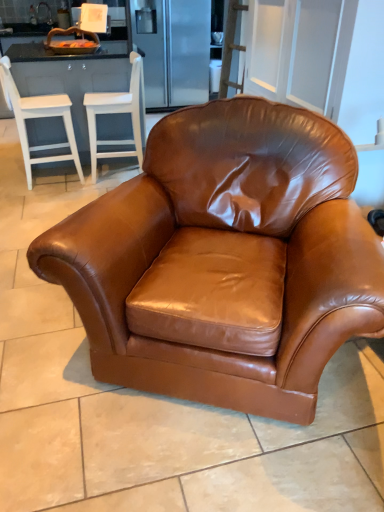
Describe the element at coordinates (68, 79) in the screenshot. I see `white wood barstools at left` at that location.

What is the approximate height of white wood bar stool at left, positioned as the 3th chair in right-to-left order?

The height of white wood bar stool at left, positioned as the 3th chair in right-to-left order, is 36.85 inches.

At what (x,y) coordinates should I click in order to perform the action: click on saddle brown leather armchair at center, the first chair in the front-to-back sequence. Please return your answer as a coordinate pair (x, y). Looking at the image, I should click on (225, 247).

This screenshot has height=512, width=384. Identify the location of white wood barstools at left. tap(68, 79).

Looking at the image, does brown leather armchair at center, positioned as the second chair in right-to-left order, seem bigger or smaller compared to white wood barstools at left?

Considering their sizes, brown leather armchair at center, positioned as the second chair in right-to-left order, takes up less space than white wood barstools at left.

At what (x,y) coordinates should I click in order to perform the action: click on dresser behind the brown leather armchair at center, which ranks as the first chair in back-to-front order. Please return your answer as a coordinate pair (x, y). Looking at the image, I should click on (68, 79).

Is brown leather armchair at center, which ranks as the first chair in back-to-front order, looking in the opposite direction of white wood barstools at left?

No, white wood barstools at left is not at the back of brown leather armchair at center, which ranks as the first chair in back-to-front order.

Between brown leather armchair at center, positioned as the second chair in right-to-left order, and white wood barstools at left, which one appears on the right side from the viewer's perspective?

Positioned to the right is brown leather armchair at center, positioned as the second chair in right-to-left order.

Considering the relative sizes of white wood bar stool at left, positioned as the 3th chair in right-to-left order, and saddle brown leather armchair at center, which ranks as the 1th chair in right-to-left order, in the image provided, is white wood bar stool at left, positioned as the 3th chair in right-to-left order, bigger than saddle brown leather armchair at center, which ranks as the 1th chair in right-to-left order,?

No, white wood bar stool at left, positioned as the 3th chair in right-to-left order, is not bigger than saddle brown leather armchair at center, which ranks as the 1th chair in right-to-left order.

From a real-world perspective, is white wood bar stool at left, arranged as the second chair when viewed from the front, physically above saddle brown leather armchair at center, acting as the third chair starting from the back?

Incorrect, from a real-world perspective, white wood bar stool at left, arranged as the second chair when viewed from the front, is lower than saddle brown leather armchair at center, acting as the third chair starting from the back.

Relative to saddle brown leather armchair at center, acting as the third chair starting from the back, is white wood bar stool at left, placed as the second chair when sorted from back to front, in front or behind?

white wood bar stool at left, placed as the second chair when sorted from back to front, is behind saddle brown leather armchair at center, acting as the third chair starting from the back.

Considering the relative sizes of saddle brown leather armchair at center, acting as the third chair starting from the back, and brown leather armchair at center, the third chair in the front-to-back sequence, in the image provided, is saddle brown leather armchair at center, acting as the third chair starting from the back, bigger than brown leather armchair at center, the third chair in the front-to-back sequence,?

Yes, saddle brown leather armchair at center, acting as the third chair starting from the back, is bigger than brown leather armchair at center, the third chair in the front-to-back sequence.

How different are the orientations of saddle brown leather armchair at center, which ranks as the 1th chair in right-to-left order, and brown leather armchair at center, the third chair in the front-to-back sequence, in degrees?

58.7 degrees.

Who is more distant, saddle brown leather armchair at center, which ranks as the 1th chair in right-to-left order, or brown leather armchair at center, positioned as the second chair in right-to-left order?

brown leather armchair at center, positioned as the second chair in right-to-left order, is more distant.

Is saddle brown leather armchair at center, which is counted as the third chair, starting from the left, completely or partially outside of brown leather armchair at center, which ranks as the first chair in back-to-front order?

saddle brown leather armchair at center, which is counted as the third chair, starting from the left, is positioned outside brown leather armchair at center, which ranks as the first chair in back-to-front order.

Does saddle brown leather armchair at center, the first chair in the front-to-back sequence, have a greater height compared to white wood barstools at left?

Yes, saddle brown leather armchair at center, the first chair in the front-to-back sequence, is taller than white wood barstools at left.

Could you tell me if saddle brown leather armchair at center, the first chair in the front-to-back sequence, is facing white wood barstools at left?

No, saddle brown leather armchair at center, the first chair in the front-to-back sequence, does not turn towards white wood barstools at left.

Does saddle brown leather armchair at center, which ranks as the 1th chair in right-to-left order, appear on the right side of white wood barstools at left?

Yes, saddle brown leather armchair at center, which ranks as the 1th chair in right-to-left order, is to the right of white wood barstools at left.

From a real-world perspective, which object stands above the other?

From a 3D spatial view, saddle brown leather armchair at center, acting as the third chair starting from the back, is above.

This screenshot has width=384, height=512. Identify the location of dresser located on the right of white wood bar stool at left, the first chair positioned from the left. (68, 79).

Which object is closer to the camera, white wood bar stool at left, the first chair positioned from the left, or white wood barstools at left?

white wood bar stool at left, the first chair positioned from the left, is more forward.

From the image's perspective, which one is positioned lower, white wood bar stool at left, positioned as the 3th chair in right-to-left order, or white wood barstools at left?

white wood bar stool at left, positioned as the 3th chair in right-to-left order, appears lower in the image.

From a real-world perspective, which is physically below, white wood bar stool at left, positioned as the 3th chair in right-to-left order, or white wood barstools at left?

white wood barstools at left is physically lower.

From a real-world perspective, is brown leather armchair at center, which ranks as the first chair in back-to-front order, under white wood bar stool at left, arranged as the second chair when viewed from the front?

Yes.

Which object is further away from the camera taking this photo, brown leather armchair at center, which ranks as the first chair in back-to-front order, or white wood bar stool at left, placed as the second chair when sorted from back to front?

Positioned behind is brown leather armchair at center, which ranks as the first chair in back-to-front order.

Which of these two, brown leather armchair at center, the second chair viewed from the left, or white wood bar stool at left, placed as the second chair when sorted from back to front, is smaller?

white wood bar stool at left, placed as the second chair when sorted from back to front.

Considering the points (139, 156) and (7, 82), which point is behind, point (139, 156) or point (7, 82)?

The point (139, 156) is farther from the camera.

Would you say saddle brown leather armchair at center, which ranks as the 1th chair in right-to-left order, is part of white wood barstools at left's contents?

That's incorrect, saddle brown leather armchair at center, which ranks as the 1th chair in right-to-left order, is not inside white wood barstools at left.

Considering the sizes of white wood barstools at left and saddle brown leather armchair at center, which ranks as the 1th chair in right-to-left order, in the image, is white wood barstools at left wider or thinner than saddle brown leather armchair at center, which ranks as the 1th chair in right-to-left order,?

white wood barstools at left is thinner than saddle brown leather armchair at center, which ranks as the 1th chair in right-to-left order.

Are white wood barstools at left and saddle brown leather armchair at center, which ranks as the 1th chair in right-to-left order, beside each other?

No.

Identify the location of the 1st chair in front of the white wood barstools at left, starting your count from the anchor. The image size is (384, 512). (117, 113).

The image size is (384, 512). Find the location of `chair above the white wood bar stool at left, placed as the second chair when sorted from back to front (from a real-world perspective)`. chair above the white wood bar stool at left, placed as the second chair when sorted from back to front (from a real-world perspective) is located at coordinates (225, 247).

When comparing their distances from white wood barstools at left, does white wood bar stool at left, arranged as the second chair when viewed from the front, or brown leather armchair at center, which ranks as the first chair in back-to-front order, seem closer?

The object closer to white wood barstools at left is brown leather armchair at center, which ranks as the first chair in back-to-front order.

Estimate the real-world distances between objects in this image. Which object is further from saddle brown leather armchair at center, which ranks as the 1th chair in right-to-left order, brown leather armchair at center, which ranks as the first chair in back-to-front order, or white wood barstools at left?

white wood barstools at left.

When comparing their distances from white wood bar stool at left, the first chair positioned from the left, does saddle brown leather armchair at center, the first chair in the front-to-back sequence, or white wood barstools at left seem further?

saddle brown leather armchair at center, the first chair in the front-to-back sequence.

In the scene shown: Considering their positions, is saddle brown leather armchair at center, acting as the third chair starting from the back, positioned further to white wood barstools at left than brown leather armchair at center, positioned as the second chair in right-to-left order?

saddle brown leather armchair at center, acting as the third chair starting from the back, is positioned further to the anchor white wood barstools at left.

Estimate the real-world distances between objects in this image. Which object is further from saddle brown leather armchair at center, which ranks as the 1th chair in right-to-left order, white wood bar stool at left, arranged as the second chair when viewed from the front, or white wood barstools at left?

white wood bar stool at left, arranged as the second chair when viewed from the front, lies further to saddle brown leather armchair at center, which ranks as the 1th chair in right-to-left order, than the other object.

From the image, which object appears to be nearer to saddle brown leather armchair at center, which ranks as the 1th chair in right-to-left order, brown leather armchair at center, the third chair in the front-to-back sequence, or white wood bar stool at left, arranged as the second chair when viewed from the front?

Based on the image, brown leather armchair at center, the third chair in the front-to-back sequence, appears to be nearer to saddle brown leather armchair at center, which ranks as the 1th chair in right-to-left order.

Based on their spatial positions, is white wood barstools at left or saddle brown leather armchair at center, which is counted as the third chair, starting from the left, further from brown leather armchair at center, the second chair viewed from the left?

saddle brown leather armchair at center, which is counted as the third chair, starting from the left.

From the image, which object appears to be farther from white wood barstools at left, white wood bar stool at left, placed as the second chair when sorted from back to front, or saddle brown leather armchair at center, which is counted as the third chair, starting from the left?

Among the two, saddle brown leather armchair at center, which is counted as the third chair, starting from the left, is located further to white wood barstools at left.

Locate an element on the screen. dresser between white wood bar stool at left, the first chair positioned from the left, and brown leather armchair at center, the third chair in the front-to-back sequence is located at coordinates (68, 79).

The width and height of the screenshot is (384, 512). Identify the location of chair located between saddle brown leather armchair at center, which is counted as the third chair, starting from the left, and brown leather armchair at center, the third chair in the front-to-back sequence, in the depth direction. (41, 117).